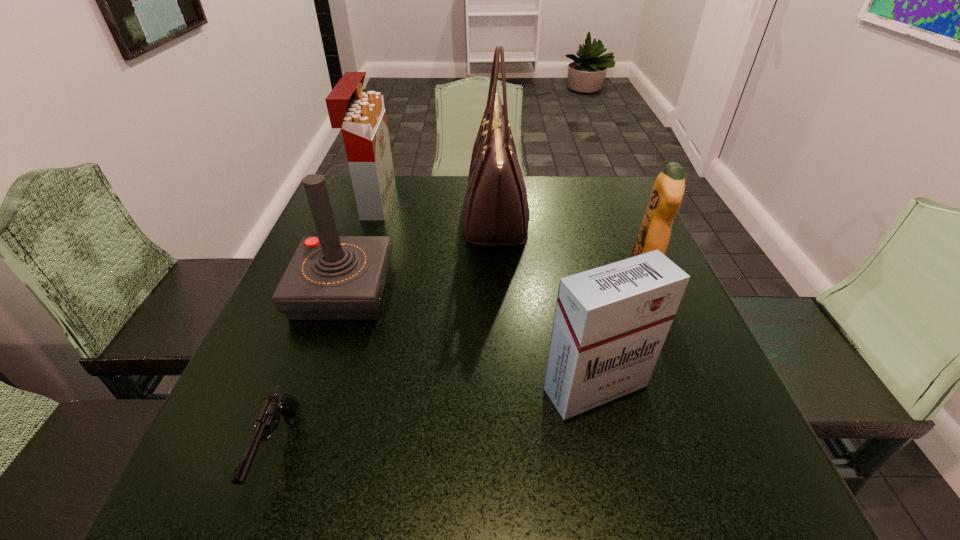
I want to click on vacant space at the right edge, so 675,394.

This screenshot has width=960, height=540. In the image, there is a desktop. In order to click on free region at the far left corner in this screenshot , I will do `click(336, 191)`.

In the image, there is a desktop. Where is `vacant space at the far right corner`? This screenshot has width=960, height=540. vacant space at the far right corner is located at coordinates (614, 209).

Where is `free space at the near right corner of the desktop`? free space at the near right corner of the desktop is located at coordinates [x=688, y=464].

I want to click on vacant point located between the rightmost object and the joystick, so [x=493, y=280].

Find the location of a particular element. vacant area that lies between the tallest object and the nearer cigarette case is located at coordinates tap(545, 302).

You are a GUI agent. You are given a task and a screenshot of the screen. Output one action in this format:
    pyautogui.click(x=<x>, y=<y>)
    Task: Click on the vacant space in between the detergent and the tallest object
    
    Given the screenshot: What is the action you would take?
    pyautogui.click(x=570, y=243)

The height and width of the screenshot is (540, 960). Find the location of `vacant area that lies between the joystick and the handbag`. vacant area that lies between the joystick and the handbag is located at coordinates (420, 254).

Find the location of `empty location between the handbag and the joystick`. empty location between the handbag and the joystick is located at coordinates (420, 254).

Identify the location of unoccupied position between the joystick and the shorter cigarette case. This screenshot has height=540, width=960. (469, 339).